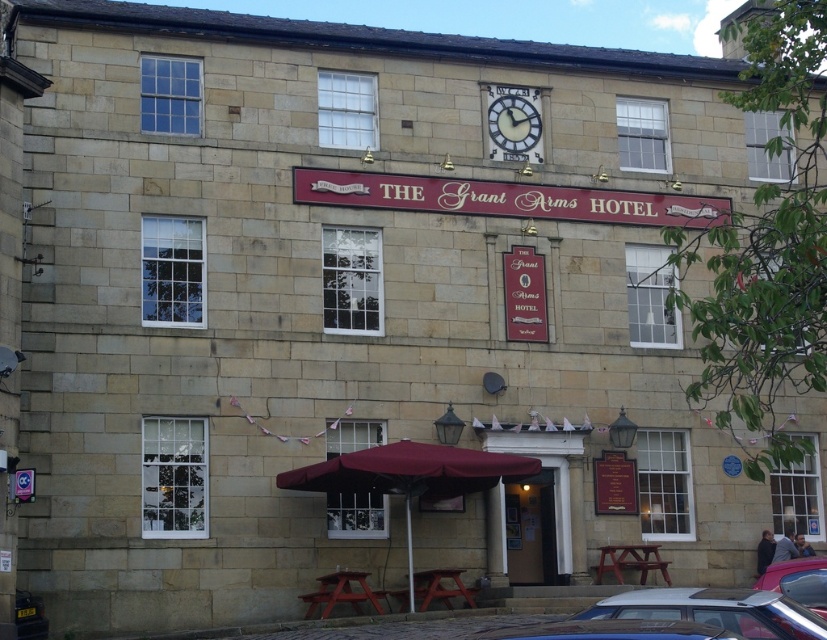
Question: Can you confirm if metallic blue car at lower center is positioned to the right of shiny silver car at lower right?

Choices:
 (A) yes
 (B) no

Answer: (B)

Question: Which object appears closest to the camera in this image?

Choices:
 (A) white painted clock face at center
 (B) metallic silver car at lower center
 (C) shiny silver car at lower right
 (D) metallic blue car at lower center

Answer: (B)

Question: Is metallic blue car at lower center smaller than metallic silver car at lower center?

Choices:
 (A) yes
 (B) no

Answer: (B)

Question: Which of these objects is positioned farthest from the metallic blue car at lower center?

Choices:
 (A) shiny silver car at lower right
 (B) white painted clock face at center

Answer: (B)

Question: Which point is farther from the camera taking this photo?

Choices:
 (A) (706, 621)
 (B) (639, 628)

Answer: (A)

Question: Does metallic silver car at lower center appear over white painted clock face at center?

Choices:
 (A) yes
 (B) no

Answer: (B)